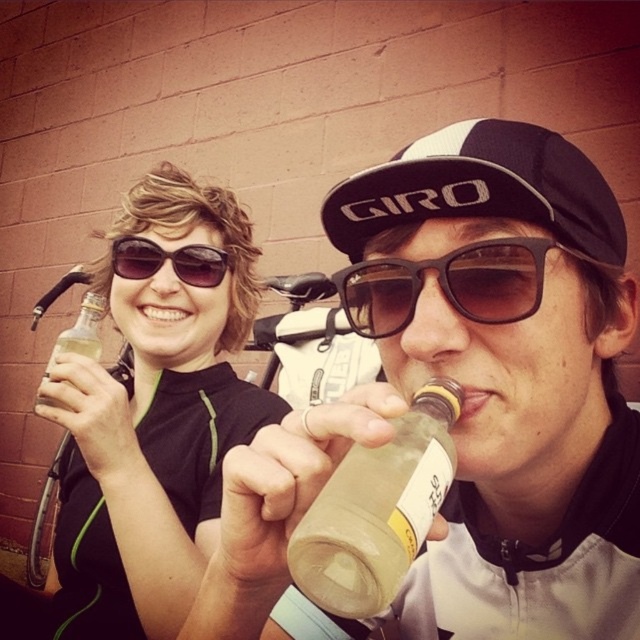
You are standing at a distance and want to reach the point marked at coordinates point (x=563, y=570). If your maximum comfortable reaching distance is 20 inches, can you comfortably reach that point?

The point marked at coordinates point (x=563, y=570) is 22.05 inches away from you, which exceeds your maximum comfortable reaching distance of 20 inches. Therefore, you cannot comfortably reach that point.

You are a photographer trying to capture a closeup of the black mesh cap at center and the black plastic sunglasses at upper left in the scene. Since you want to focus on both objects equally, which object should you adjust your camera to prioritize in terms of framing to ensure both are clearly visible?

The black mesh cap at center is wider than the black plastic sunglasses at upper left, so you should frame the black mesh cap at center first to accommodate its larger size, ensuring both objects are visible.

You are a photographer trying to capture a candid shot of the two people in the scene. You notice the translucent plastic bottle at center and the matte black sunglasses at upper left. Which object is closer to the left side of the frame?

The matte black sunglasses at upper left are closer to the left side of the frame since they are positioned to the left of the translucent plastic bottle at center.